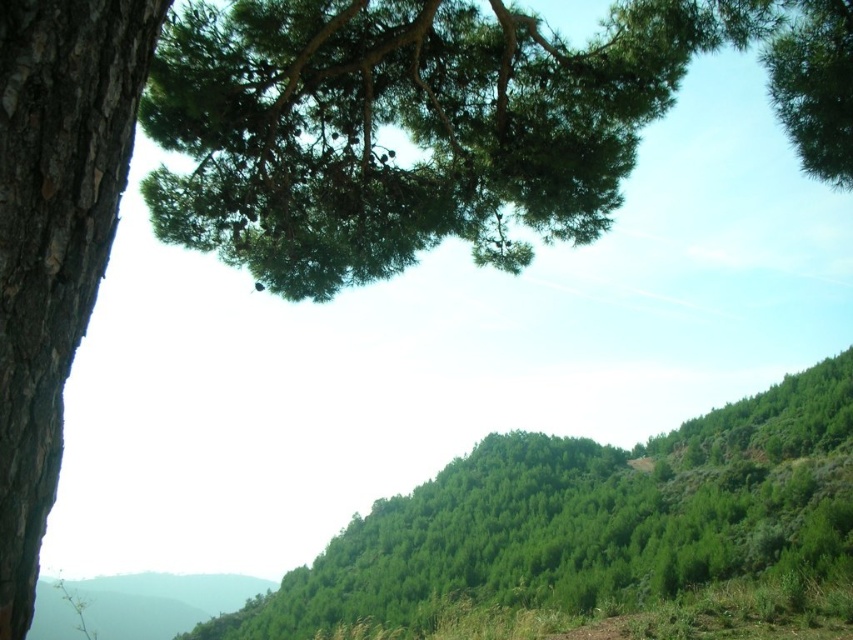
Question: Does green needle-like leaves at upper center appear over smooth bark tree at left?

Choices:
 (A) no
 (B) yes

Answer: (B)

Question: Which of the following is the farthest from the observer?

Choices:
 (A) smooth bark tree at left
 (B) green needle-like leaves at upper center

Answer: (B)

Question: Can you confirm if green needle-like leaves at upper center is positioned above smooth bark tree at left?

Choices:
 (A) yes
 (B) no

Answer: (A)

Question: Which point is closer to the camera?

Choices:
 (A) smooth bark tree at left
 (B) green leafy tree at center

Answer: (A)

Question: Among these objects, which one is nearest to the camera?

Choices:
 (A) smooth bark tree at left
 (B) green leafy tree at center
 (C) green needle-like leaves at upper center

Answer: (A)

Question: Does green needle-like leaves at upper center have a greater width compared to smooth bark tree at left?

Choices:
 (A) yes
 (B) no

Answer: (A)